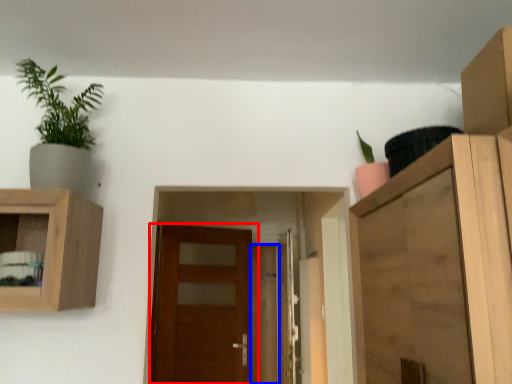
Question: Which point is further to the camera, door (highlighted by a red box) or door (highlighted by a blue box)?

Choices:
 (A) door
 (B) door

Answer: (B)